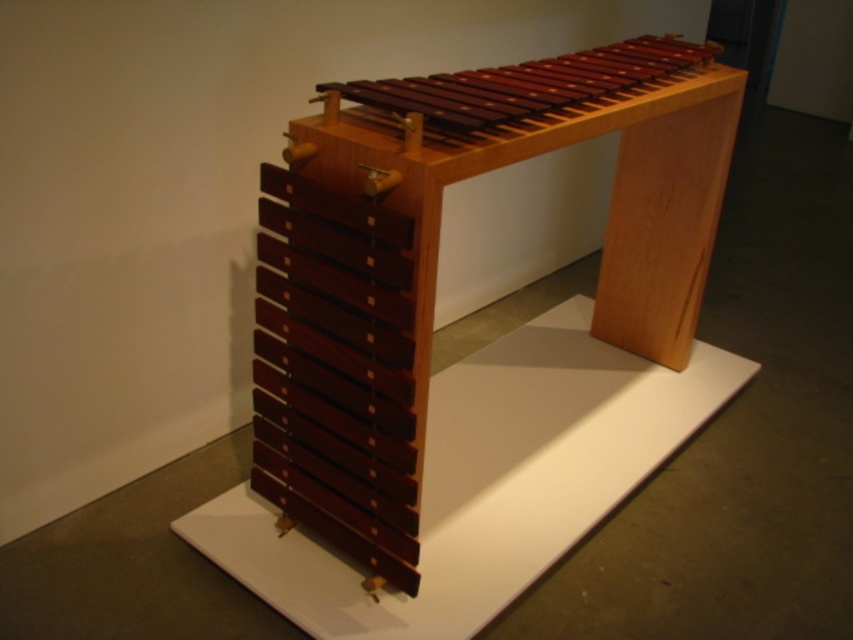
Question: Which point appears farthest from the camera in this image?

Choices:
 (A) (467, 140)
 (B) (352, 348)

Answer: (B)

Question: Does mahogany wood xylophone at center appear under polished wood xylophone at center?

Choices:
 (A) yes
 (B) no

Answer: (A)

Question: Can you confirm if mahogany wood xylophone at center is positioned to the left of polished wood xylophone at center?

Choices:
 (A) no
 (B) yes

Answer: (B)

Question: Can you confirm if mahogany wood xylophone at center is bigger than polished wood xylophone at center?

Choices:
 (A) yes
 (B) no

Answer: (A)